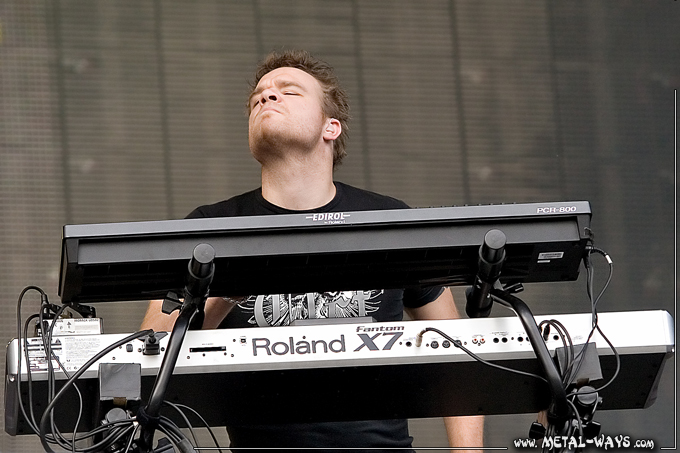
Where is `black bottom of keyboard`? The height and width of the screenshot is (453, 680). black bottom of keyboard is located at coordinates (471, 400).